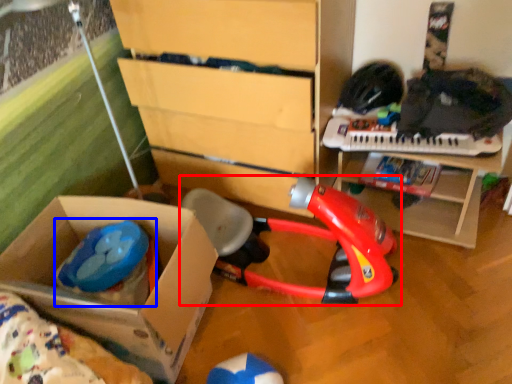
Question: Among these objects, which one is nearest to the camera, toy (highlighted by a red box) or toy (highlighted by a blue box)?

Choices:
 (A) toy
 (B) toy

Answer: (A)